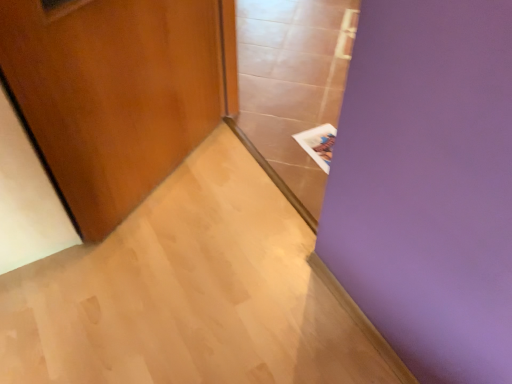
Question: Does transparent glass door at center have a lesser height compared to white paper at upper right?

Choices:
 (A) yes
 (B) no

Answer: (B)

Question: Does transparent glass door at center have a larger size compared to white paper at upper right?

Choices:
 (A) yes
 (B) no

Answer: (A)

Question: Is transparent glass door at center not near white paper at upper right?

Choices:
 (A) yes
 (B) no

Answer: (B)

Question: From a real-world perspective, is transparent glass door at center over white paper at upper right?

Choices:
 (A) no
 (B) yes

Answer: (B)

Question: From the image's perspective, is transparent glass door at center on white paper at upper right?

Choices:
 (A) yes
 (B) no

Answer: (A)

Question: Considering the relative positions of transparent glass door at center and white paper at upper right in the image provided, is transparent glass door at center to the right of white paper at upper right from the viewer's perspective?

Choices:
 (A) no
 (B) yes

Answer: (A)

Question: Are wooden door at left and white paper at upper right making contact?

Choices:
 (A) yes
 (B) no

Answer: (B)

Question: Considering the relative sizes of wooden door at left and white paper at upper right in the image provided, is wooden door at left taller than white paper at upper right?

Choices:
 (A) yes
 (B) no

Answer: (A)

Question: Is wooden door at left positioned behind white paper at upper right?

Choices:
 (A) no
 (B) yes

Answer: (A)

Question: Is wooden door at left at the left side of white paper at upper right?

Choices:
 (A) yes
 (B) no

Answer: (A)

Question: From the image's perspective, is wooden door at left on white paper at upper right?

Choices:
 (A) no
 (B) yes

Answer: (B)

Question: From the image's perspective, would you say wooden door at left is shown under white paper at upper right?

Choices:
 (A) no
 (B) yes

Answer: (A)

Question: Is transparent glass door at center behind wooden door at left?

Choices:
 (A) yes
 (B) no

Answer: (B)